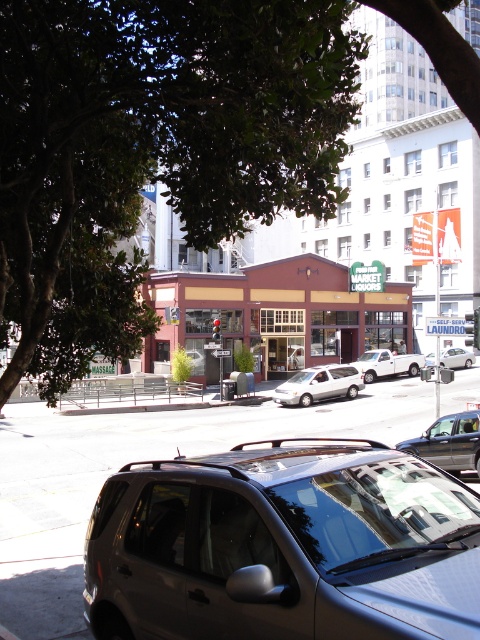
Question: Does metallic silver sedan at center appear on the left side of white matte van at center?

Choices:
 (A) no
 (B) yes

Answer: (B)

Question: Which point appears closest to the camera in this image?

Choices:
 (A) click(x=183, y=166)
 (B) click(x=359, y=356)
 (C) click(x=324, y=381)

Answer: (A)

Question: Is green leafy tree at upper left to the right of white matte van at center from the viewer's perspective?

Choices:
 (A) no
 (B) yes

Answer: (A)

Question: Which point appears closest to the camera in this image?

Choices:
 (A) (66, 68)
 (B) (379, 355)
 (C) (358, 372)
 (D) (468, 362)

Answer: (A)

Question: Does metallic silver suv at center have a lesser width compared to metallic silver sedan at center?

Choices:
 (A) no
 (B) yes

Answer: (B)

Question: Which object is closer to the camera taking this photo?

Choices:
 (A) white matte van at center
 (B) green leafy tree at upper left
 (C) metallic silver suv at center

Answer: (C)